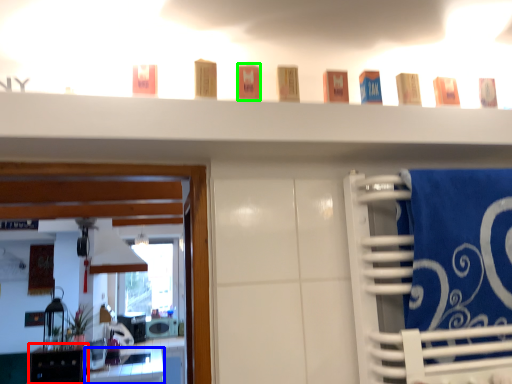
Question: Which object is the farthest from cabinetry (highlighted by a red box)? Choose among these: vanity (highlighted by a blue box) or toiletry (highlighted by a green box).

Choices:
 (A) vanity
 (B) toiletry

Answer: (B)